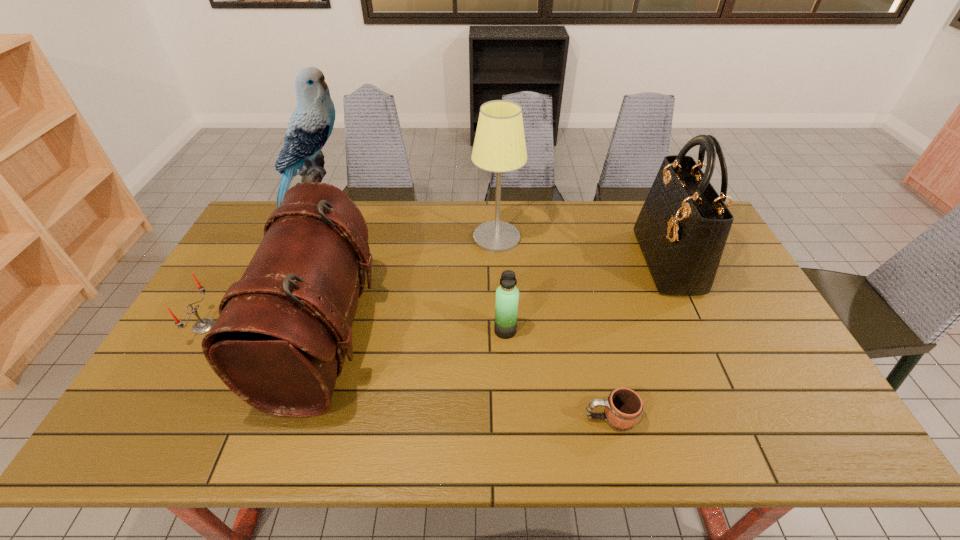
Locate an element on the screen. Image resolution: width=960 pixels, height=540 pixels. free spot between the parakeet and the table lamp is located at coordinates (407, 230).

In order to click on object that is the third closest one to the table lamp in this screenshot , I will do `click(682, 228)`.

Locate which object is the third closest to the candle. Please provide its 2D coordinates. Your answer should be formatted as a tuple, i.e. [(x, y)], where the tuple contains the x and y coordinates of a point satisfying the conditions above.

[(499, 146)]

At what (x,y) coordinates should I click in order to perform the action: click on free point that satisfies the following two spatial constraints: 1. on the front side of the table lamp; 2. on the right side of the thermos bottle. Please return your answer as a coordinate pair (x, y). Looking at the image, I should click on (x=501, y=330).

You are a GUI agent. You are given a task and a screenshot of the screen. Output one action in this format:
    pyautogui.click(x=<x>, y=<y>)
    Task: Click on the free space that satisfies the following two spatial constraints: 1. on the front-facing side of the sixth tallest object; 2. on the left side of the third shortest object
    
    Given the screenshot: What is the action you would take?
    pyautogui.click(x=202, y=330)